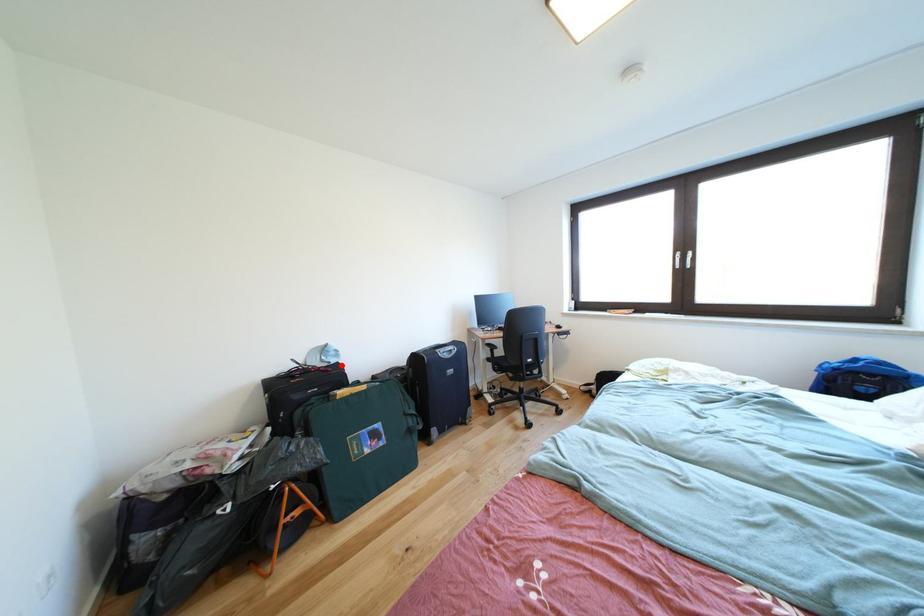
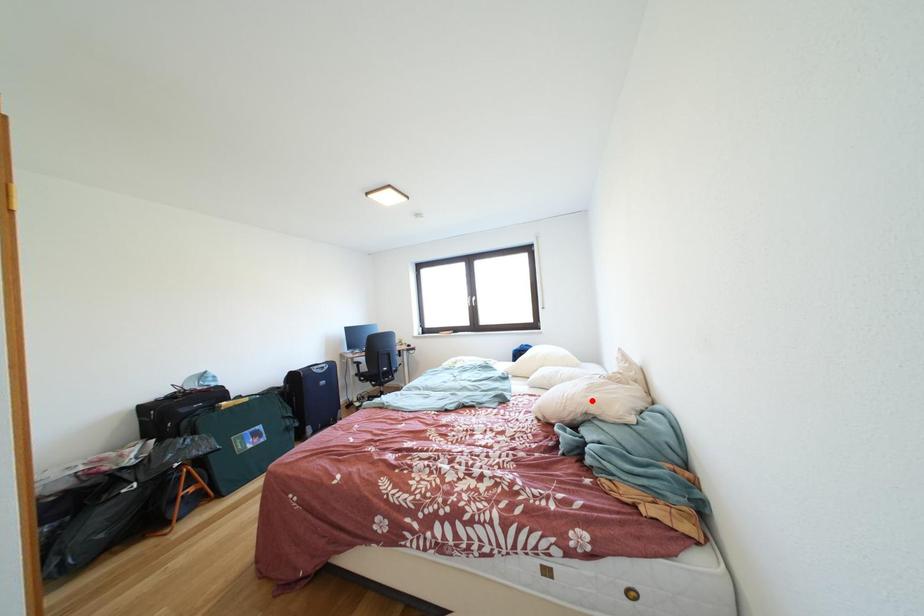
I am providing you with two images of the same scene from different viewpoints. A red point is marked on the first image and another point is marked on the second image. Are the points marked in image1 and image2 representing the same 3D position?

No